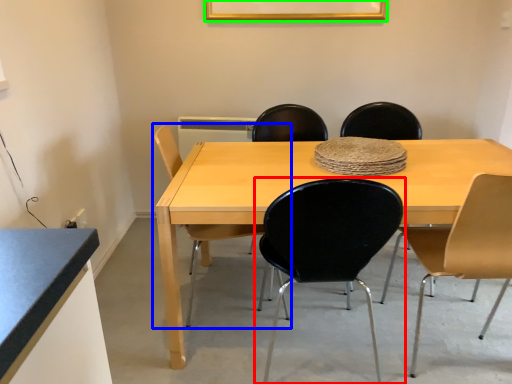
Question: Which is farther away from chair (highlighted by a red box)? chair (highlighted by a blue box) or picture frame (highlighted by a green box)?

Choices:
 (A) chair
 (B) picture frame

Answer: (B)